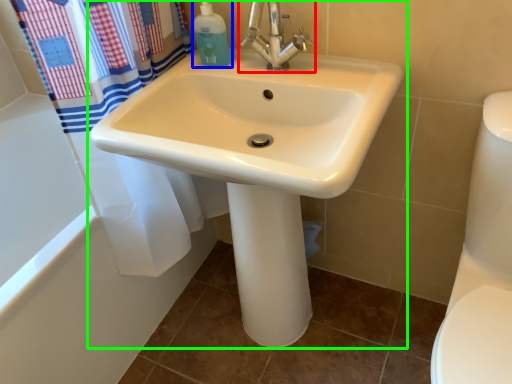
Question: Which is nearer to the tap (highlighted by a red box)? cleaning product (highlighted by a blue box) or sink (highlighted by a green box).

Choices:
 (A) cleaning product
 (B) sink

Answer: (A)